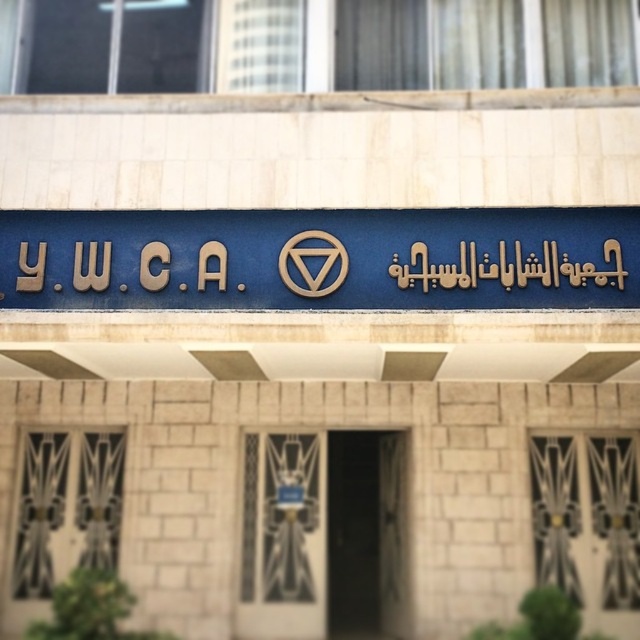
Question: Is blue metallic sign at center positioned at the back of gold metallic signboard at center?

Choices:
 (A) no
 (B) yes

Answer: (A)

Question: Among these points, which one is farthest from the camera?

Choices:
 (A) (372, 250)
 (B) (582, 266)

Answer: (A)

Question: Is blue metallic sign at center to the right of gold metallic signboard at center from the viewer's perspective?

Choices:
 (A) yes
 (B) no

Answer: (B)

Question: Does blue metallic sign at center have a lesser width compared to gold metallic signboard at center?

Choices:
 (A) yes
 (B) no

Answer: (B)